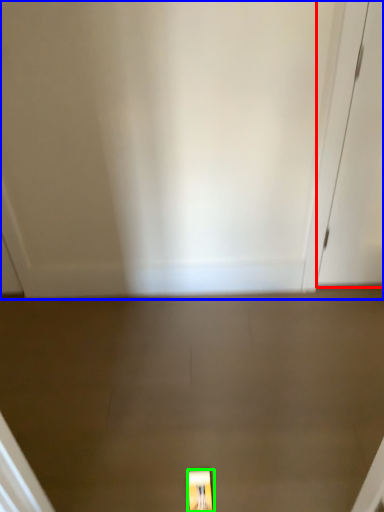
Question: Considering the real-world distances, which object is closest to door (highlighted by a red box)? door (highlighted by a blue box) or light fixture (highlighted by a green box).

Choices:
 (A) door
 (B) light fixture

Answer: (A)